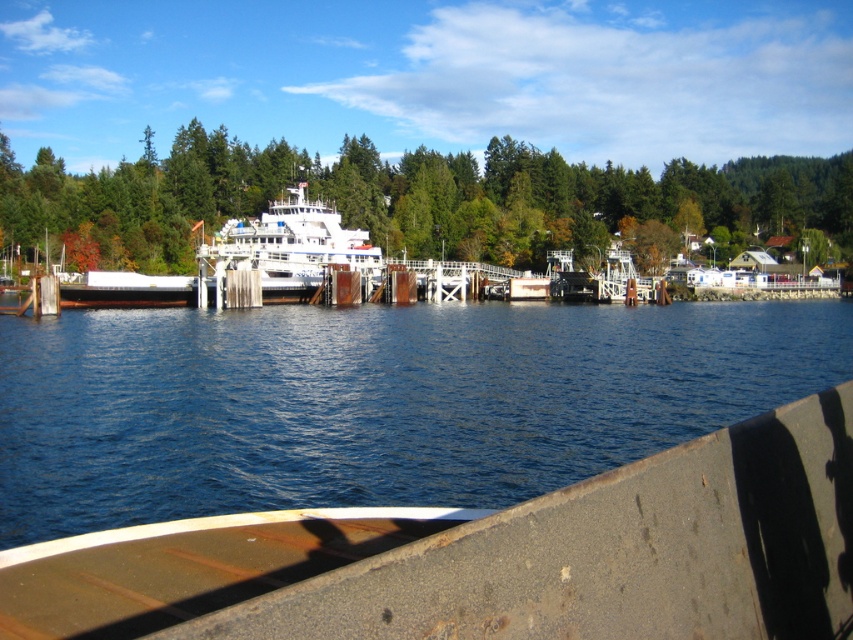
Is blue water at center thinner than green matte tree at center?

Yes, blue water at center is thinner than green matte tree at center.

Between point (792, 310) and point (416, 202), which one is positioned in front?

Point (792, 310) is more forward.

Measure the distance between blue water at center and camera.

blue water at center and camera are 43.19 feet apart.

Locate an element on the screen. blue water at center is located at coordinates pyautogui.click(x=374, y=401).

Can you confirm if green matte tree at center is positioned to the left of white glossy ferry at center?

No, green matte tree at center is not to the left of white glossy ferry at center.

Who is taller, green matte tree at center or white glossy ferry at center?

With more height is green matte tree at center.

Is point (378, 164) farther from camera compared to point (306, 225)?

Yes, it is.

Where is `green matte tree at center`? The width and height of the screenshot is (853, 640). green matte tree at center is located at coordinates (416, 200).

How distant is blue water at center from white glossy ferry at center?

blue water at center and white glossy ferry at center are 54.80 feet apart from each other.

Image resolution: width=853 pixels, height=640 pixels. I want to click on blue water at center, so click(374, 401).